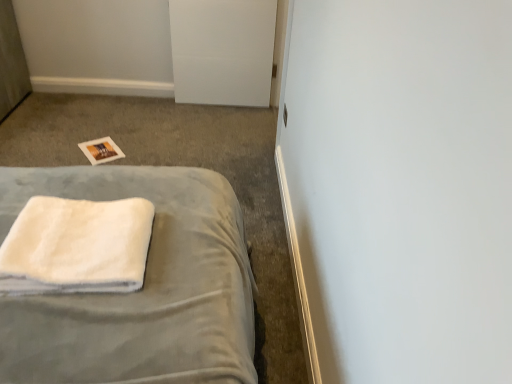
Question: In the image, is white matte door at upper center positioned in front of or behind white soft towel at lower left?

Choices:
 (A) behind
 (B) front

Answer: (A)

Question: From a real-world perspective, relative to white soft towel at lower left, is white matte door at upper center vertically above or below?

Choices:
 (A) below
 (B) above

Answer: (B)

Question: Estimate the real-world distances between objects in this image. Which object is farther from the white soft towel at lower left?

Choices:
 (A) white fluffy towel at lower left
 (B) white matte door at upper center

Answer: (B)

Question: Based on their relative distances, which object is nearer to the white matte door at upper center?

Choices:
 (A) white soft towel at lower left
 (B) white fluffy towel at lower left

Answer: (A)